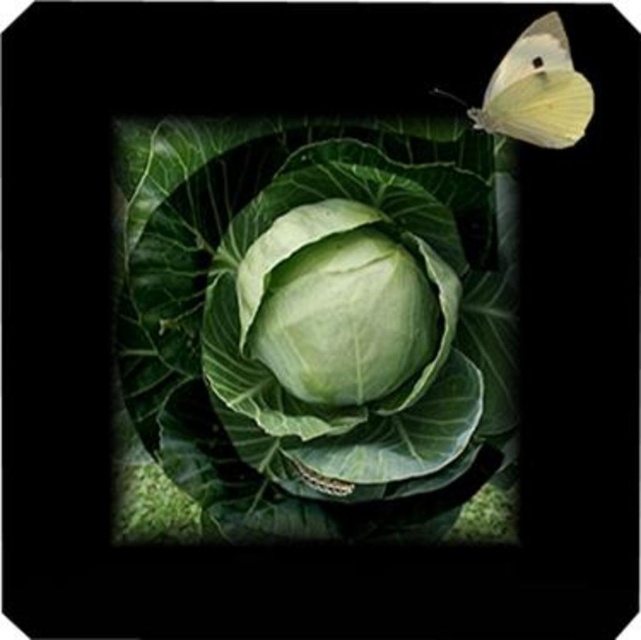
Does point (412, 161) come in front of point (494, 83)?

That is False.

Is green smooth leafy vegetable at center behind translucent yellow butterfly at upper right?

Yes, green smooth leafy vegetable at center is further from the viewer.

The image size is (641, 640). I want to click on green smooth leafy vegetable at center, so click(269, 358).

What are the coordinates of `green smooth leafy vegetable at center` in the screenshot? It's located at (269, 358).

Which is more to the left, green matte cabbage at center or translucent yellow butterfly at upper right?

green matte cabbage at center

Which is more to the right, green matte cabbage at center or translucent yellow butterfly at upper right?

translucent yellow butterfly at upper right is more to the right.

Between point (296, 280) and point (520, 84), which one is positioned behind?

The point (296, 280) is more distant.

Locate an element on the screen. Image resolution: width=641 pixels, height=640 pixels. green matte cabbage at center is located at coordinates (335, 305).

Describe the element at coordinates (269, 358) in the screenshot. I see `green smooth leafy vegetable at center` at that location.

Is green smooth leafy vegetable at center smaller than green matte cabbage at center?

Actually, green smooth leafy vegetable at center might be larger than green matte cabbage at center.

Locate an element on the screen. The image size is (641, 640). green smooth leafy vegetable at center is located at coordinates (269, 358).